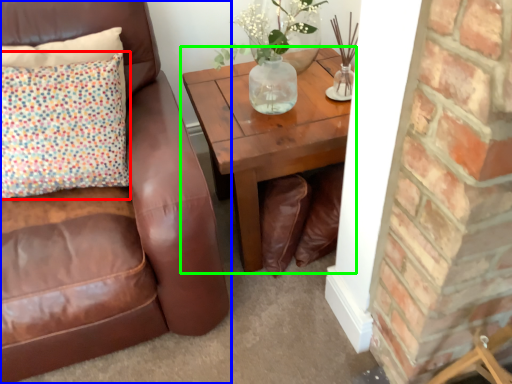
Question: Based on their relative distances, which object is farther from pillow (highlighted by a red box)? Choose from chair (highlighted by a blue box) and coffee table (highlighted by a green box).

Choices:
 (A) chair
 (B) coffee table

Answer: (B)